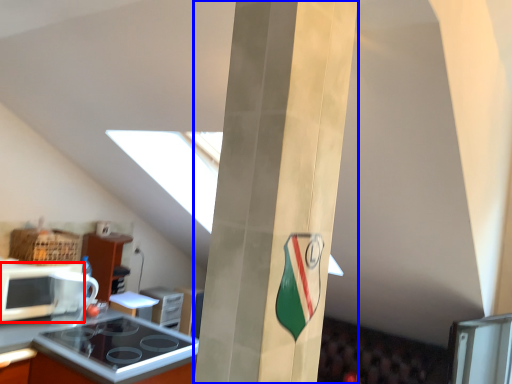
Question: Which point is closer to the camera, microwave oven (highlighted by a red box) or pillar (highlighted by a blue box)?

Choices:
 (A) microwave oven
 (B) pillar

Answer: (B)